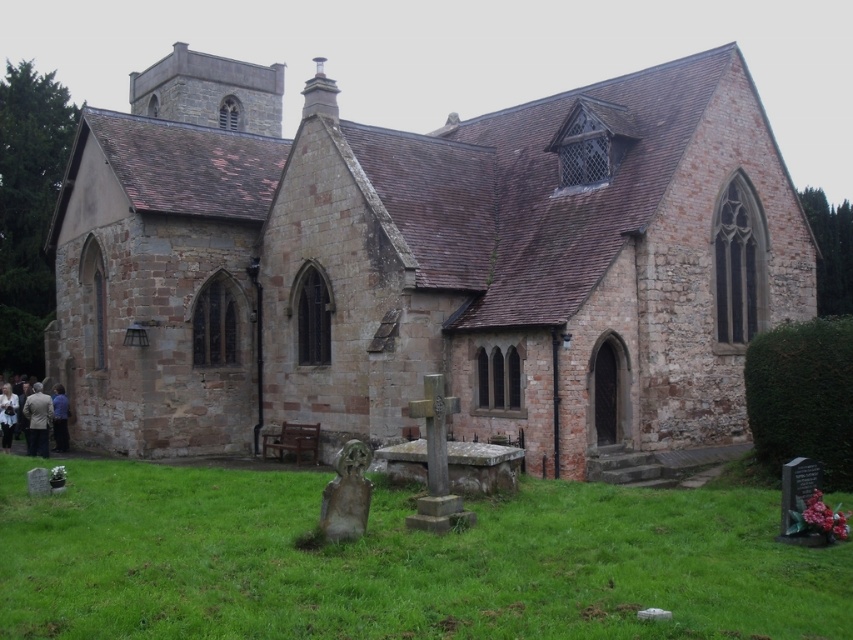
You are standing at the entrance of the church and want to walk towards the two points marked in the image. Which point, point (x=322, y=328) or point (x=33, y=538), will you reach first?

Point (x=322, y=328) is further to the viewer than point (x=33, y=538), so you will reach point (x=322, y=328) first.

You are standing at the entrance of the brown stone church at center. If you walk straight ahead, will you immediately encounter any obstacles like tombstones or crosses in the grassy area in front of the church?

The brown stone church at center is located at point [422,262]. Since the tombstones and crosses are placed in the grassy area in front of the church, walking straight ahead from the entrance would likely lead you into the cemetery area where these obstacles are present. Therefore, yes, you would encounter tombstones or crosses in the grassy area in front of the church.